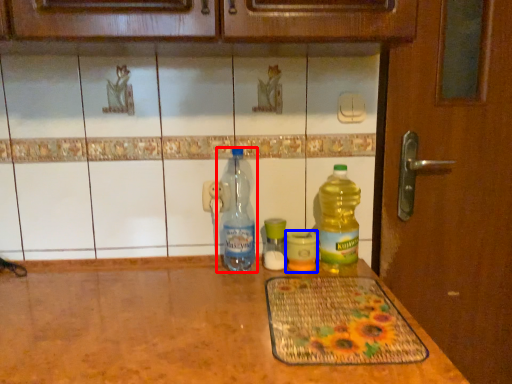
Question: Among these objects, which one is nearest to the camera, bottle (highlighted by a red box) or bottle (highlighted by a blue box)?

Choices:
 (A) bottle
 (B) bottle

Answer: (A)